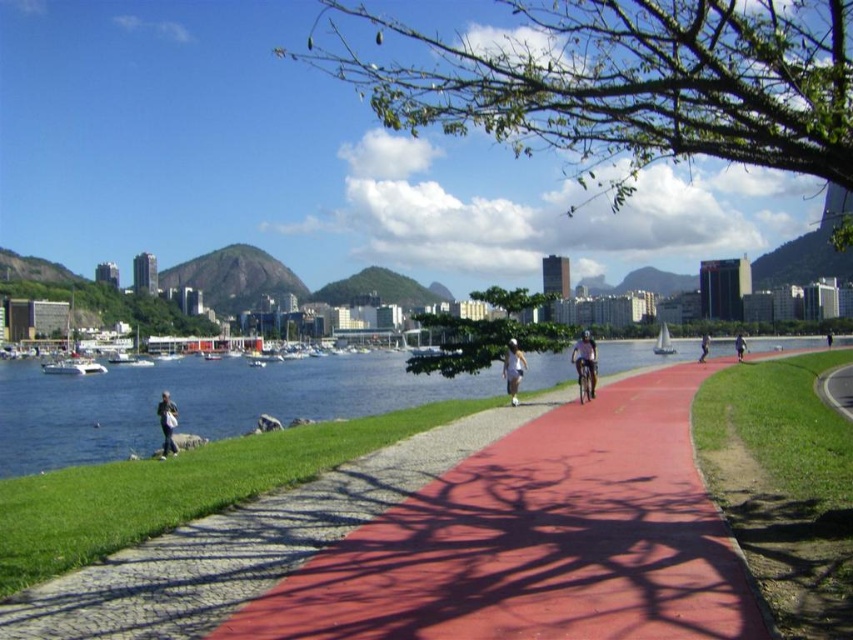
Can you confirm if light gray fabric jacket at lower left is wider than dark blue fabric jacket at center?

In fact, light gray fabric jacket at lower left might be narrower than dark blue fabric jacket at center.

Is point (170, 428) farther from camera compared to point (831, 339)?

No, it is not.

Is point (167, 440) closer to camera compared to point (830, 332)?

Yes, it is.

Locate an element on the screen. The width and height of the screenshot is (853, 640). light gray fabric jacket at lower left is located at coordinates (167, 422).

Who is positioned more to the right, white glossy boat at lower left or light gray fabric jacket at lower left?

From the viewer's perspective, light gray fabric jacket at lower left appears more on the right side.

Can you confirm if white glossy boat at lower left is positioned above light gray fabric jacket at lower left?

Yes, white glossy boat at lower left is above light gray fabric jacket at lower left.

This screenshot has width=853, height=640. In order to click on white glossy boat at lower left in this screenshot , I will do `click(73, 365)`.

Locate an element on the screen. white glossy boat at lower left is located at coordinates (73, 365).

Find the location of a particular element. This screenshot has width=853, height=640. green grass at lower right is located at coordinates pos(782,484).

Is green grass at lower right shorter than shiny red pavement at center?

No.

Is point (811, 481) in front of point (581, 396)?

Yes.

Locate an element on the screen. The image size is (853, 640). green grass at lower right is located at coordinates (782, 484).